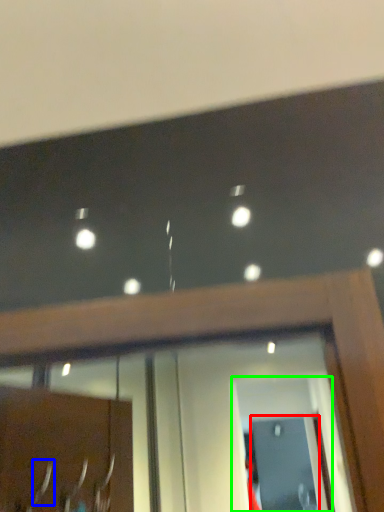
Question: Considering the real-world distances, which object is closest to screen door (highlighted by a red box)? door handle (highlighted by a blue box) or screen door (highlighted by a green box).

Choices:
 (A) door handle
 (B) screen door

Answer: (B)